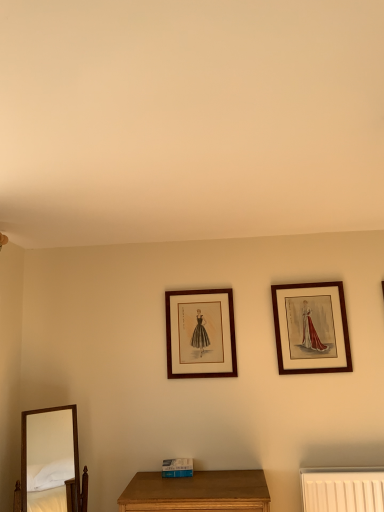
Question: Would you consider wooden framed print at upper right, the 2th picture frame viewed from the left, to be distant from matte wood picture frame at center, marked as the first picture frame in a left-to-right arrangement?

Choices:
 (A) yes
 (B) no

Answer: (B)

Question: Is wooden framed print at upper right, arranged as the 1th picture frame when viewed from the right, positioned with its back to matte wood picture frame at center, marked as the first picture frame in a left-to-right arrangement?

Choices:
 (A) no
 (B) yes

Answer: (A)

Question: Does wooden framed print at upper right, the 2th picture frame viewed from the left, have a smaller size compared to matte wood picture frame at center, marked as the first picture frame in a left-to-right arrangement?

Choices:
 (A) yes
 (B) no

Answer: (B)

Question: From a real-world perspective, is wooden framed print at upper right, the 2th picture frame viewed from the left, physically above matte wood picture frame at center, acting as the second picture frame starting from the right?

Choices:
 (A) yes
 (B) no

Answer: (B)

Question: From the image's perspective, does wooden framed print at upper right, the 2th picture frame viewed from the left, appear higher than matte wood picture frame at center, acting as the second picture frame starting from the right?

Choices:
 (A) yes
 (B) no

Answer: (A)

Question: Is point (226, 324) positioned closer to the camera than point (29, 476)?

Choices:
 (A) farther
 (B) closer

Answer: (A)

Question: Relative to wooden mirror at lower left, is matte wood picture frame at center, acting as the second picture frame starting from the right, in front or behind?

Choices:
 (A) behind
 (B) front

Answer: (A)

Question: Is matte wood picture frame at center, marked as the first picture frame in a left-to-right arrangement, inside the boundaries of wooden mirror at lower left, or outside?

Choices:
 (A) inside
 (B) outside

Answer: (B)

Question: In terms of width, does matte wood picture frame at center, acting as the second picture frame starting from the right, look wider or thinner when compared to wooden mirror at lower left?

Choices:
 (A) wide
 (B) thin

Answer: (B)

Question: Is wooden mirror at lower left taller or shorter than matte wood picture frame at center, marked as the first picture frame in a left-to-right arrangement?

Choices:
 (A) short
 (B) tall

Answer: (B)

Question: Relative to matte wood picture frame at center, acting as the second picture frame starting from the right, is wooden mirror at lower left in front or behind?

Choices:
 (A) behind
 (B) front

Answer: (B)

Question: From the image's perspective, is wooden mirror at lower left located above or below matte wood picture frame at center, marked as the first picture frame in a left-to-right arrangement?

Choices:
 (A) above
 (B) below

Answer: (B)

Question: Considering the positions of wooden mirror at lower left and matte wood picture frame at center, acting as the second picture frame starting from the right, in the image, is wooden mirror at lower left wider or thinner than matte wood picture frame at center, acting as the second picture frame starting from the right,?

Choices:
 (A) thin
 (B) wide

Answer: (B)

Question: Would you say matte wood picture frame at center, acting as the second picture frame starting from the right, is inside or outside wooden framed print at upper right, the 2th picture frame viewed from the left?

Choices:
 (A) outside
 (B) inside

Answer: (A)

Question: Is matte wood picture frame at center, marked as the first picture frame in a left-to-right arrangement, in front of or behind wooden framed print at upper right, arranged as the 1th picture frame when viewed from the right, in the image?

Choices:
 (A) front
 (B) behind

Answer: (B)